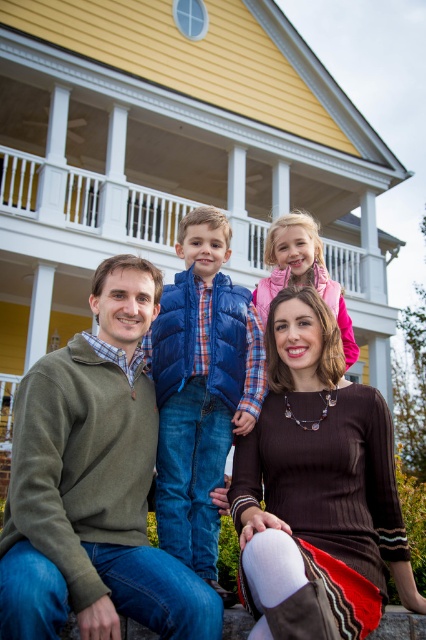
You are a photographer trying to focus on the family members. Which brown sweater is closer to you, the brown knitted sweater at center or the brown sweater at lower center?

The brown knitted sweater at center is closer to the viewer than the brown sweater at lower center.

What is the exact location of the blue puffy vest at center in the image?

The blue puffy vest at center is located at point coordinates of (201, 388).

Looking at the family photo, you notice two blue vests. The blue fleece vest at upper center and the blue puffy vest at center. Which one is positioned to the left of the other?

The blue fleece vest at upper center is positioned to the left of the blue puffy vest at center.